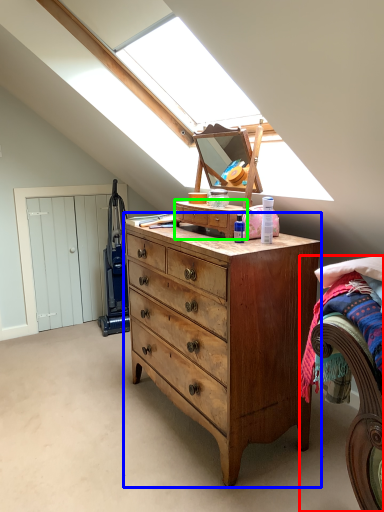
Question: Based on their relative distances, which object is farther from bed (highlighted by a red box)? Choose from chest of drawers (highlighted by a blue box) and cabinetry (highlighted by a green box).

Choices:
 (A) chest of drawers
 (B) cabinetry

Answer: (B)